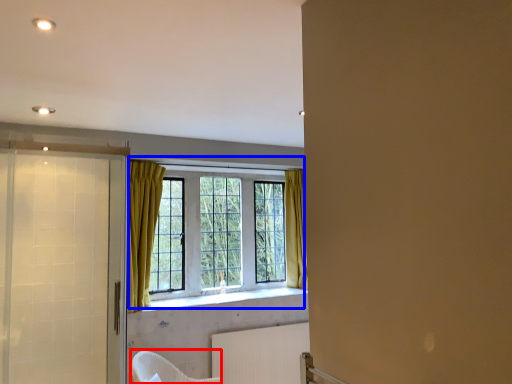
Question: Which object is further to the camera taking this photo, armchair (highlighted by a red box) or window (highlighted by a blue box)?

Choices:
 (A) armchair
 (B) window

Answer: (B)